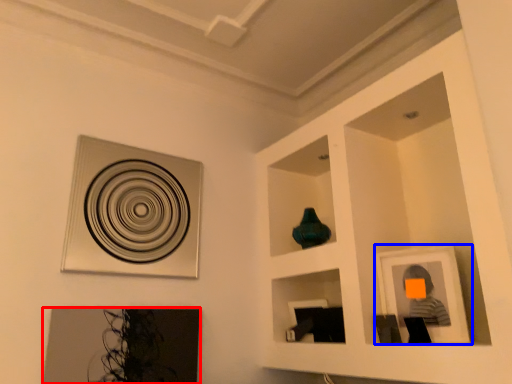
Question: Which object is further to the camera taking this photo, picture frame (highlighted by a red box) or picture frame (highlighted by a blue box)?

Choices:
 (A) picture frame
 (B) picture frame

Answer: (A)